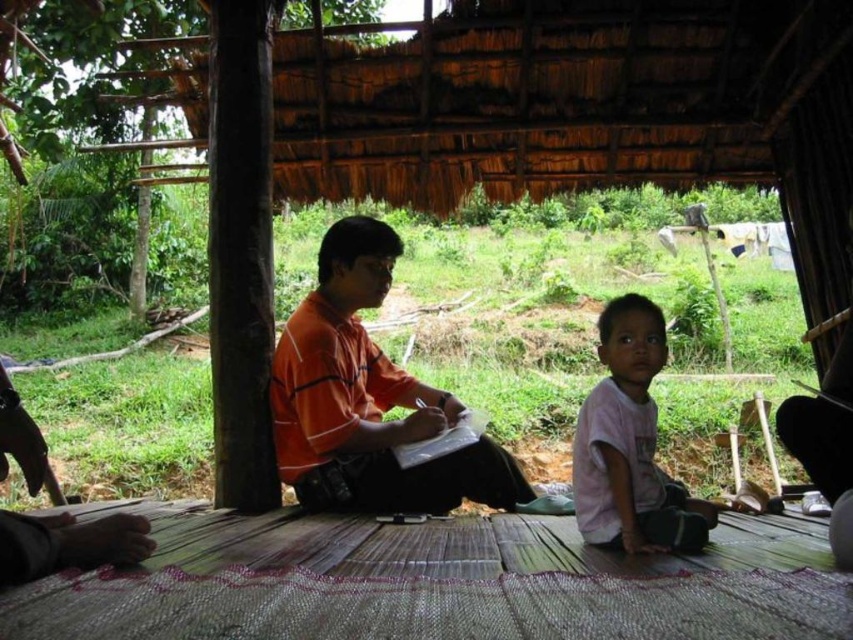
Question: Which of the following is the closest to the observer?

Choices:
 (A) tap(523, 497)
 (B) tap(637, 460)

Answer: (B)

Question: Which object appears farthest from the camera in this image?

Choices:
 (A) orange fabric shirt at center
 (B) white cotton shirt at center

Answer: (A)

Question: Does orange fabric shirt at center have a greater width compared to white cotton shirt at center?

Choices:
 (A) yes
 (B) no

Answer: (A)

Question: Is orange fabric shirt at center to the left of white cotton shirt at center from the viewer's perspective?

Choices:
 (A) yes
 (B) no

Answer: (A)

Question: Does orange fabric shirt at center come in front of white cotton shirt at center?

Choices:
 (A) no
 (B) yes

Answer: (A)

Question: Which point is farther from the camera taking this photo?

Choices:
 (A) (602, 419)
 (B) (321, 292)

Answer: (B)